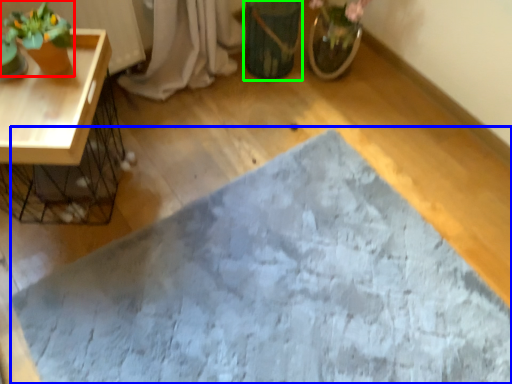
Question: Estimate the real-world distances between objects in this image. Which object is farther from houseplant (highlighted by a red box), bath mat (highlighted by a blue box) or flowerpot (highlighted by a green box)?

Choices:
 (A) bath mat
 (B) flowerpot

Answer: (A)